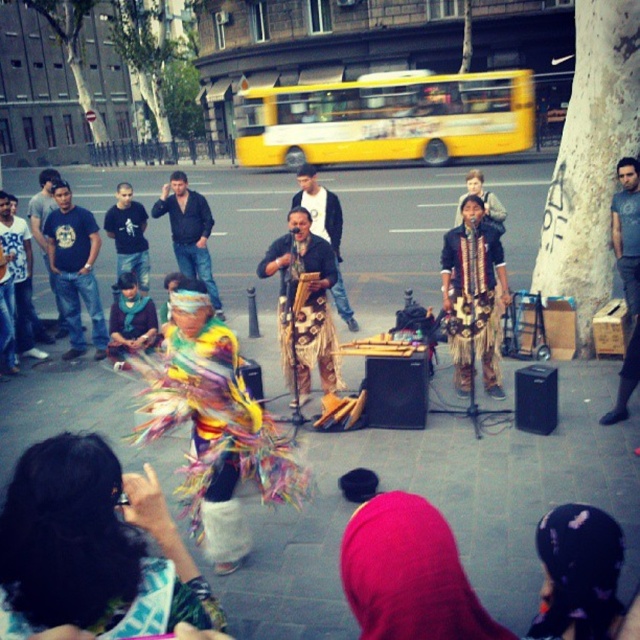
Question: Can you confirm if dark blue leather jacket at center is wider than leather-like fabric at center?

Choices:
 (A) yes
 (B) no

Answer: (B)

Question: Which is nearer to the leather-like fabric at center?

Choices:
 (A) jeans at left
 (B) dark blue leather jacket at center
 (C) dark blue shirt at center

Answer: (B)

Question: Based on their relative distances, which object is nearer to the dark blue leather jacket at center?

Choices:
 (A) leather-like fabric at center
 (B) dark blue shirt at center
 (C) jeans at left

Answer: (B)

Question: Which object appears closest to the camera in this image?

Choices:
 (A) dark blue leather jacket at center
 (B) dark blue shirt at center

Answer: (B)

Question: Can you confirm if dark blue leather jacket at center is smaller than leather-like fabric at center?

Choices:
 (A) yes
 (B) no

Answer: (A)

Question: Is jeans at left wider than dark blue leather jacket at center?

Choices:
 (A) no
 (B) yes

Answer: (A)